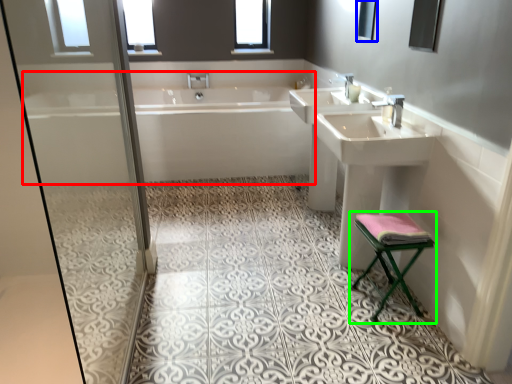
Question: Considering the real-world distances, which object is closest to bathtub (highlighted by a red box)? mirror (highlighted by a blue box) or furniture (highlighted by a green box).

Choices:
 (A) mirror
 (B) furniture

Answer: (A)